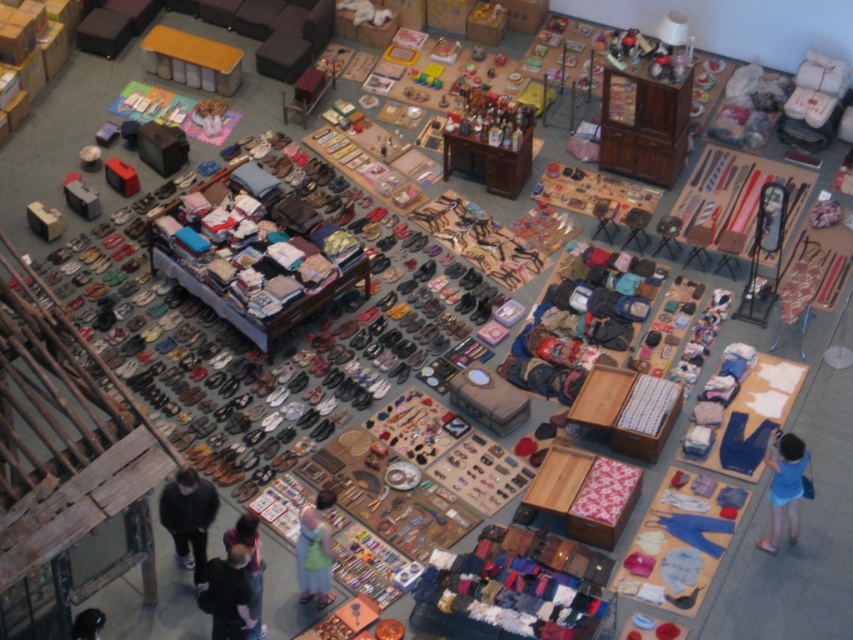
Question: Which object is the farthest from the dark blue jeans at lower center?

Choices:
 (A) dark gray sweater at lower left
 (B) blue fabric dress at lower right
 (C) dark blue fabric at lower center

Answer: (B)

Question: Does blue fabric dress at lower right have a lesser width compared to light blue fabric dress at center?

Choices:
 (A) yes
 (B) no

Answer: (B)

Question: Is blue fabric dress at lower right below dark blue jeans at lower center?

Choices:
 (A) yes
 (B) no

Answer: (B)

Question: Among these points, which one is nearest to the camera?

Choices:
 (A) (320, 586)
 (B) (772, 540)
 (C) (247, 516)

Answer: (C)

Question: Which object is farther from the camera taking this photo?

Choices:
 (A) dark gray sweater at lower left
 (B) blue fabric dress at lower right
 (C) dark blue fabric at lower center
 (D) light blue fabric dress at center

Answer: (D)

Question: Can you confirm if dark blue fabric at lower center is thinner than blue fabric dress at lower right?

Choices:
 (A) yes
 (B) no

Answer: (B)